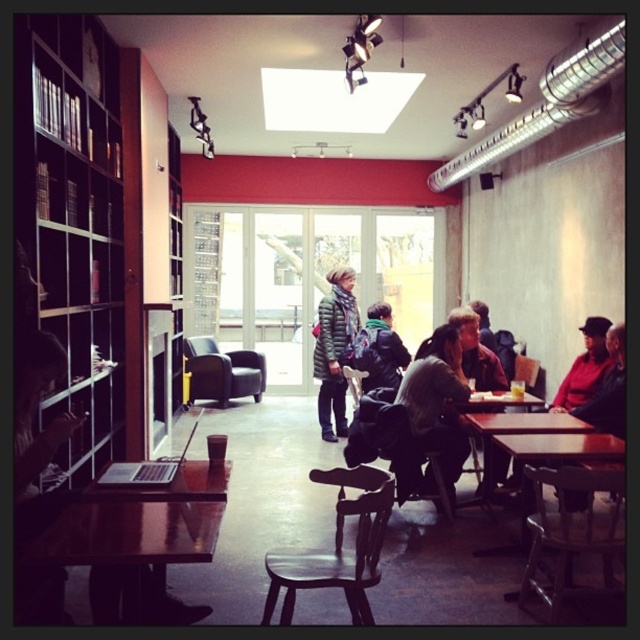
You are a customer in this space and want to hang both jackets on a coat rack located between them. Since the dark green textured jacket at center is larger, will it require more space on the coat rack compared to the dark brown leather jacket at right?

Yes, the dark green textured jacket at center is larger in size than the dark brown leather jacket at right, so it will require more space on the coat rack.